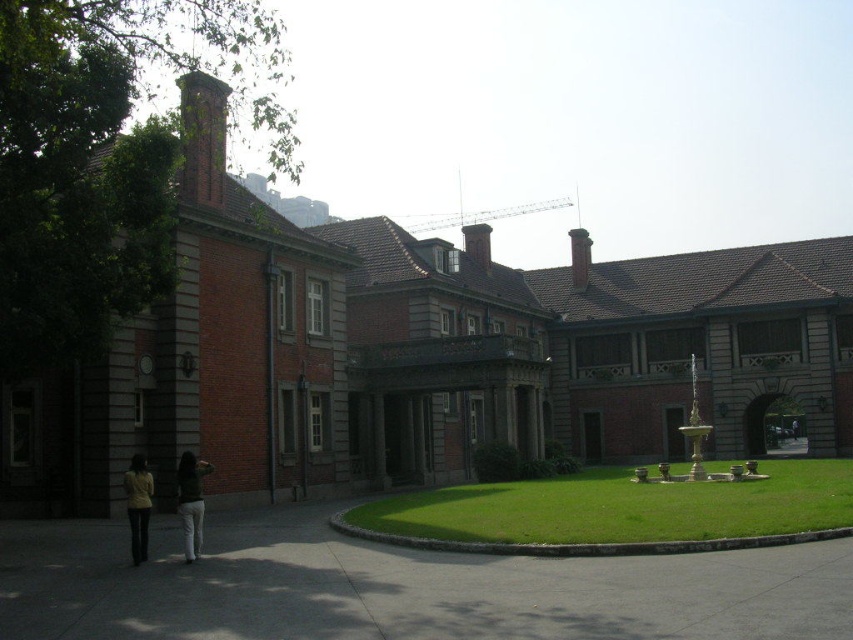
Who is more forward, (788, 488) or (132, 483)?

Positioned in front is point (132, 483).

Who is more distant from viewer, [502,516] or [149,497]?

The point [502,516] is behind.

This screenshot has height=640, width=853. In order to click on green grass at center in this screenshot , I will do `click(614, 512)`.

Is the position of green grass at center less distant than that of dark green sweater at center?

Yes, it is in front of dark green sweater at center.

Is green grass at center thinner than dark green sweater at center?

No.

Identify the location of green grass at center. (614, 512).

Consider the image. Does dark green sweater at center have a greater width compared to yellow fabric jacket at lower left?

Incorrect, dark green sweater at center's width does not surpass yellow fabric jacket at lower left's.

From the picture: Who is taller, dark green sweater at center or yellow fabric jacket at lower left?

Standing taller between the two is dark green sweater at center.

Between point (186, 506) and point (142, 472), which one is positioned in front?

Point (186, 506)

Find the location of a particular element. The width and height of the screenshot is (853, 640). dark green sweater at center is located at coordinates (190, 500).